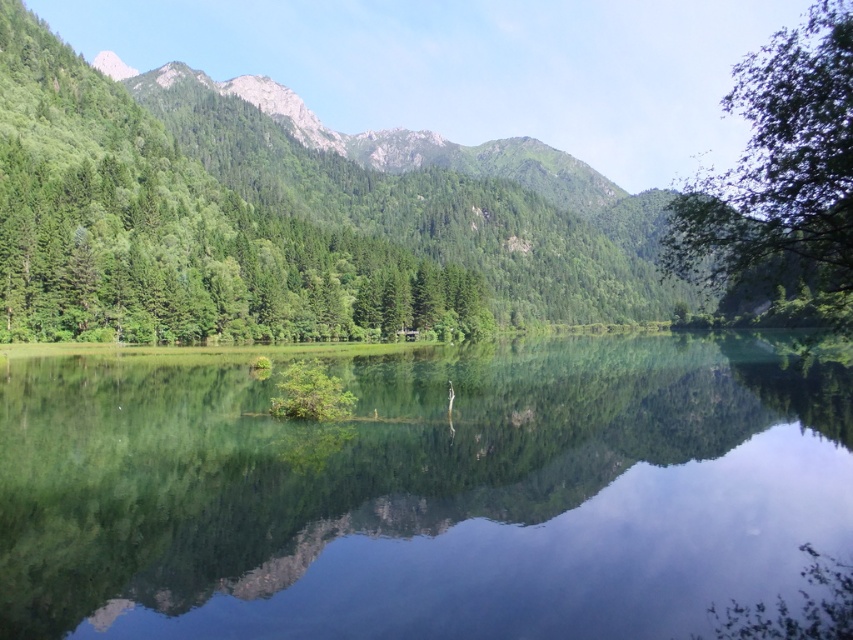
Question: Can you confirm if green reflective water at center is smaller than green leafy tree at upper right?

Choices:
 (A) yes
 (B) no

Answer: (A)

Question: Which point is closer to the camera?

Choices:
 (A) green matte tree at left
 (B) green leafy tree at upper right
 (C) green reflective water at center

Answer: (C)

Question: Which of the following is the farthest from the observer?

Choices:
 (A) (341, 545)
 (B) (817, 100)
 (C) (115, 241)

Answer: (C)

Question: Is the position of green reflective water at center less distant than that of green leafy tree at upper right?

Choices:
 (A) no
 (B) yes

Answer: (B)

Question: Is green reflective water at center positioned before green matte tree at left?

Choices:
 (A) yes
 (B) no

Answer: (A)

Question: Which point is farther to the camera?

Choices:
 (A) (721, 358)
 (B) (454, 285)
 (C) (805, 132)

Answer: (B)